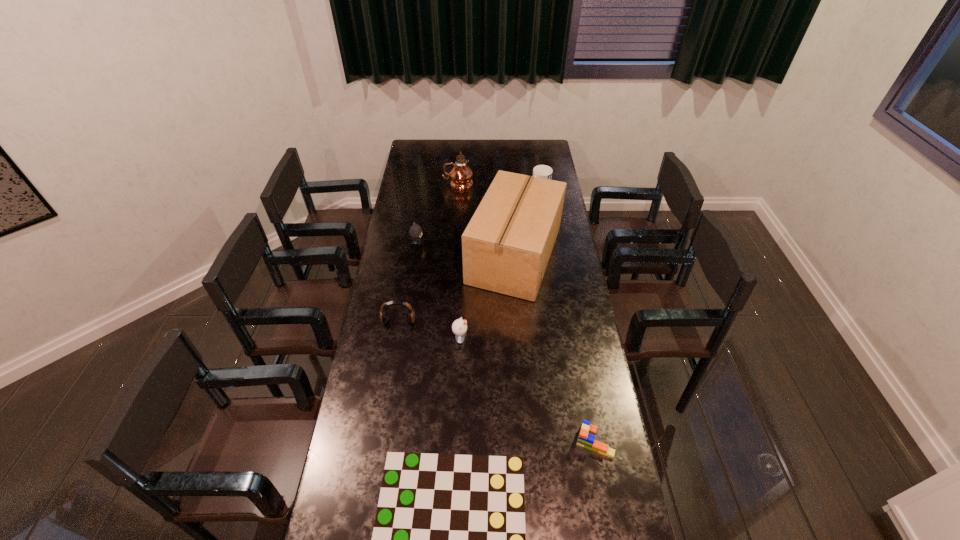
Identify which object is located as the fourth nearest to the shortest object. Please provide its 2D coordinates. Your answer should be formatted as a tuple, i.e. [(x, y)], where the tuple contains the x and y coordinates of a point satisfying the conditions above.

[(506, 247)]

Locate which object is the seventh closest to the right kitten. Please provide its 2D coordinates. Your answer should be formatted as a tuple, i.e. [(x, y)], where the tuple contains the x and y coordinates of a point satisfying the conditions above.

[(461, 175)]